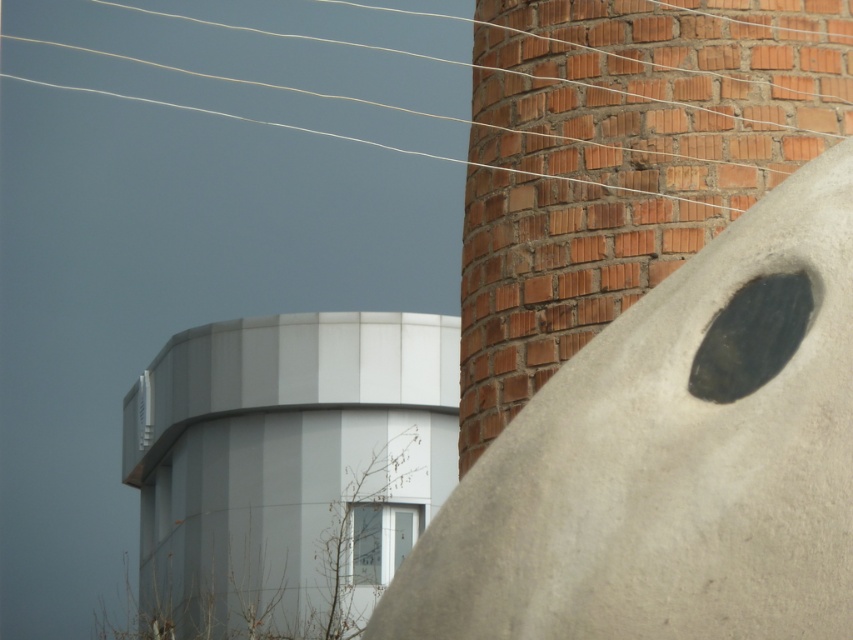
You are an architect analyzing the spatial relationship between the brick chimney at center and the white smooth tower at center in the image. Which structure is positioned higher in the scene?

The brick chimney at center is located above the white smooth tower at center, so it is positioned higher in the scene.

You are an architect designing a new city park between the brick chimney at center and the white smooth tower at center. To ensure safety, you need to know which structure is taller. Which one is taller?

The white smooth tower at center is taller than the brick chimney at center.

You are an architect planning to place a new sculpture between the smooth concrete sculpture at center and the brick chimney at center. Considering their widths, which existing sculpture should the new sculpture be placed closer to to maintain balance?

The smooth concrete sculpture at center is wider than the brick chimney at center. To maintain balance, the new sculpture should be placed closer to the brick chimney at center to compensate for the difference in widths.